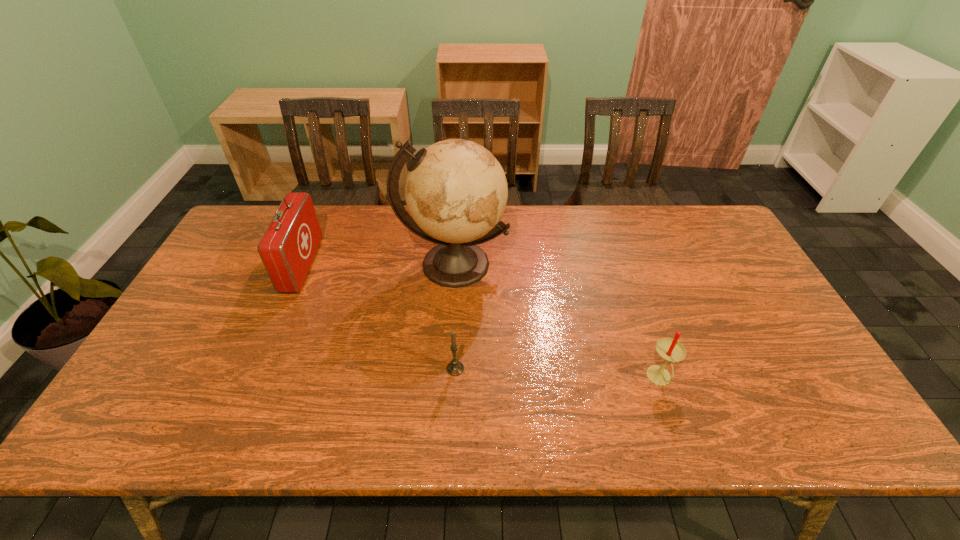
Find the location of a particular element. vacant point located on the back of the shorter candle is located at coordinates (460, 278).

I want to click on globe at the far edge, so click(456, 191).

This screenshot has height=540, width=960. I want to click on the first-aid kit present at the far edge, so click(x=287, y=249).

In the image, there is a desktop. Identify the location of vacant region at the far edge. This screenshot has width=960, height=540. (575, 224).

In the image, there is a desktop. Identify the location of vacant space at the near edge. (487, 409).

In the image, there is a desktop. Identify the location of vacant space at the left edge. pyautogui.click(x=260, y=268).

At what (x,y) coordinates should I click in order to perform the action: click on empty space between the globe and the shorter candle. Please return your answer as a coordinate pair (x, y). The width and height of the screenshot is (960, 540). Looking at the image, I should click on (454, 316).

Identify the location of free space between the left candle and the third shortest object. The image size is (960, 540). (379, 317).

The image size is (960, 540). Identify the location of vacant area between the second tallest object and the shortest object. (379, 317).

Locate an element on the screen. This screenshot has width=960, height=540. free space between the third shortest object and the shortest object is located at coordinates (379, 317).